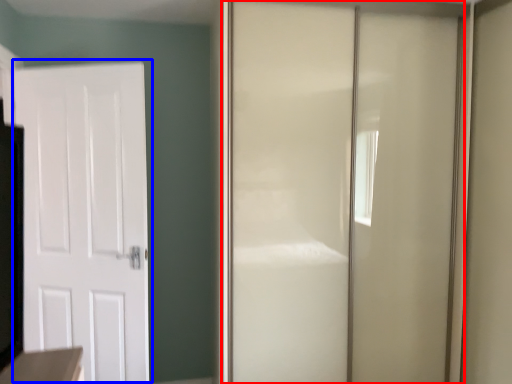
Question: Which object appears closest to the camera in this image, door (highlighted by a red box) or door (highlighted by a blue box)?

Choices:
 (A) door
 (B) door

Answer: (A)